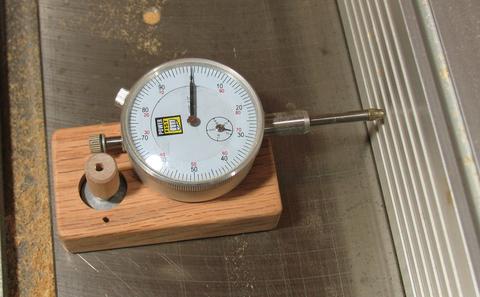
Where is `adjuster knob`? adjuster knob is located at coordinates tap(95, 142).